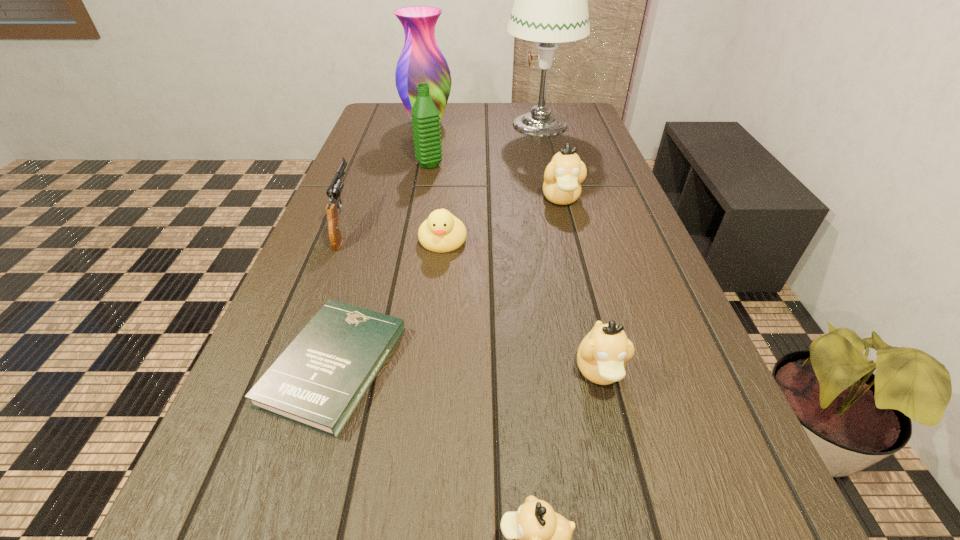
At what (x,y) coordinates should I click in order to perform the action: click on the tallest object. Please return your answer as a coordinate pair (x, y). This screenshot has width=960, height=540. Looking at the image, I should click on (550, 6).

You are a GUI agent. You are given a task and a screenshot of the screen. Output one action in this format:
    pyautogui.click(x=<x>, y=<y>)
    Task: Click on the purple vase
    
    Given the screenshot: What is the action you would take?
    pyautogui.click(x=421, y=61)

At what (x,y) coordinates should I click in order to perform the action: click on vase. Please return your answer as a coordinate pair (x, y). The width and height of the screenshot is (960, 540). Looking at the image, I should click on (421, 61).

You are a GUI agent. You are given a task and a screenshot of the screen. Output one action in this format:
    pyautogui.click(x=<x>, y=<y>)
    Task: Click on the third tallest object
    The image size is (960, 540).
    Given the screenshot: What is the action you would take?
    pyautogui.click(x=425, y=116)

Identify the location of green water bottle. This screenshot has height=540, width=960. (425, 116).

Where is `the tallest duckling`? The height and width of the screenshot is (540, 960). the tallest duckling is located at coordinates pos(563,176).

The width and height of the screenshot is (960, 540). I want to click on the biggest tan duckling, so click(x=563, y=176).

At what (x,y) coordinates should I click in order to perform the action: click on black gun. Please return your answer as a coordinate pair (x, y). This screenshot has height=540, width=960. Looking at the image, I should click on (334, 191).

The image size is (960, 540). Identify the location of the second farthest tan duckling. (602, 355).

Where is `the third shortest duckling`? The image size is (960, 540). the third shortest duckling is located at coordinates (602, 355).